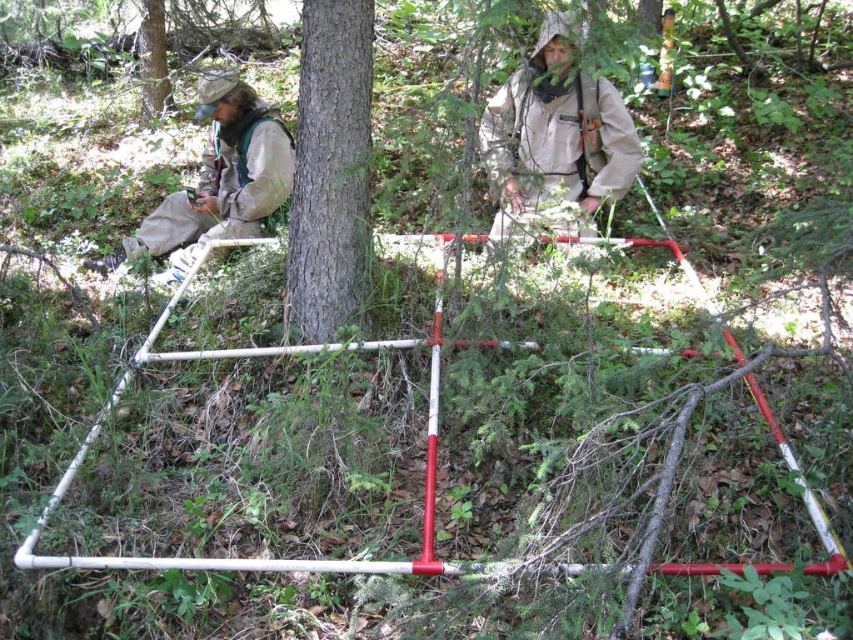
Between smooth bark tree at center and smooth bark tree at upper left, which one appears on the right side from the viewer's perspective?

Positioned to the right is smooth bark tree at center.

Between smooth bark tree at center and smooth bark tree at upper left, which one has less height?

With less height is smooth bark tree at upper left.

What do you see at coordinates (331, 170) in the screenshot? I see `smooth bark tree at center` at bounding box center [331, 170].

The width and height of the screenshot is (853, 640). Find the location of `smooth bark tree at center`. smooth bark tree at center is located at coordinates (331, 170).

Between tan fabric jacket at center and khaki fabric jacket at left, which one appears on the right side from the viewer's perspective?

tan fabric jacket at center is more to the right.

Locate an element on the screen. tan fabric jacket at center is located at coordinates (556, 140).

Is smooth bark tree at center positioned at the back of khaki fabric jacket at left?

No, it is not.

Is smooth bark tree at center shorter than khaki fabric jacket at left?

No, smooth bark tree at center is not shorter than khaki fabric jacket at left.

This screenshot has height=640, width=853. Identify the location of smooth bark tree at center. (331, 170).